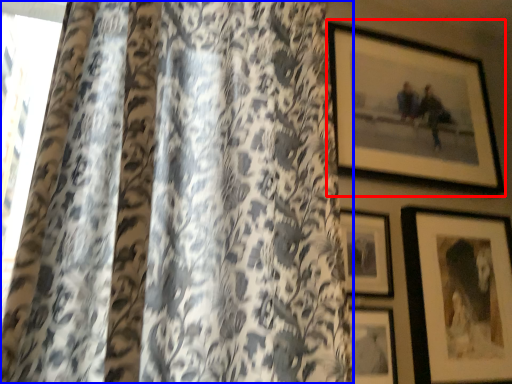
Question: Which of the following is the farthest to the observer, picture frame (highlighted by a red box) or curtain (highlighted by a blue box)?

Choices:
 (A) picture frame
 (B) curtain

Answer: (A)